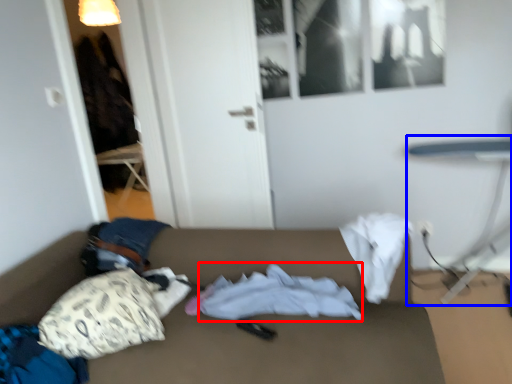
Question: Among these objects, which one is farthest to the camera, sheet (highlighted by a red box) or table (highlighted by a blue box)?

Choices:
 (A) sheet
 (B) table

Answer: (B)